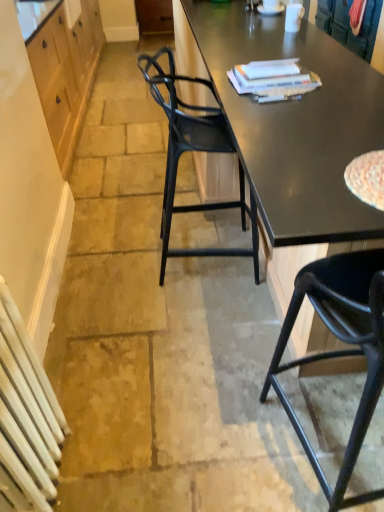
I want to click on spots to the right of white glossy coffee cup at upper center, so click(310, 32).